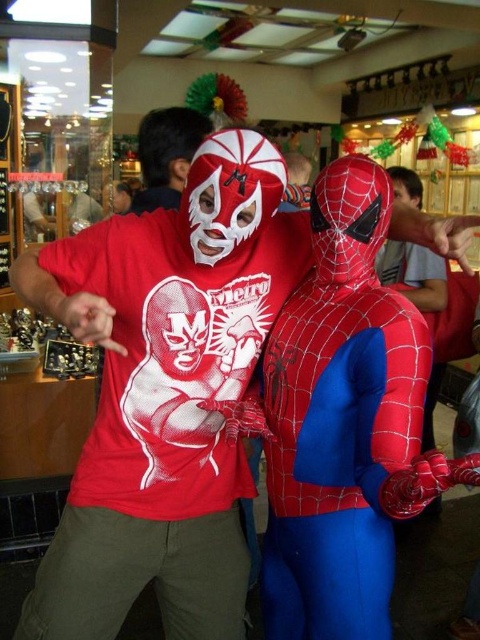
Question: Which is farther from the matte white mask at center?

Choices:
 (A) matte white mask at upper center
 (B) red spandex suit at center
 (C) matte plastic mask at center

Answer: (B)

Question: Is matte white mask at upper center smaller than matte white mask at center?

Choices:
 (A) no
 (B) yes

Answer: (B)

Question: Considering the relative positions of red spandex suit at center and matte white mask at upper center in the image provided, where is red spandex suit at center located with respect to matte white mask at upper center?

Choices:
 (A) above
 (B) below

Answer: (B)

Question: Which object is the closest to the red spandex suit at center?

Choices:
 (A) white matte mask at center
 (B) matte plastic mask at center
 (C) matte white mask at center

Answer: (A)

Question: Which object is the closest to the red spandex suit at center?

Choices:
 (A) matte white mask at center
 (B) matte plastic mask at center
 (C) matte white mask at upper center

Answer: (C)

Question: Does white matte mask at center have a smaller size compared to matte plastic mask at center?

Choices:
 (A) yes
 (B) no

Answer: (A)